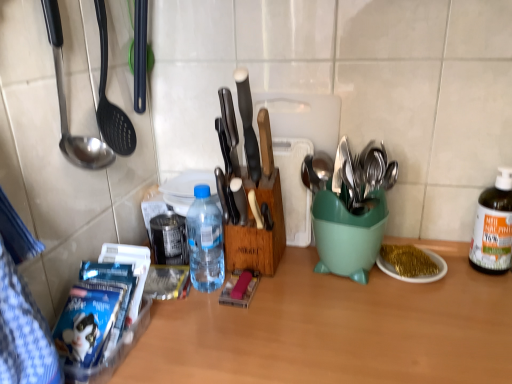
Identify the location of free location in front of gold glitter plate at right. (430, 321).